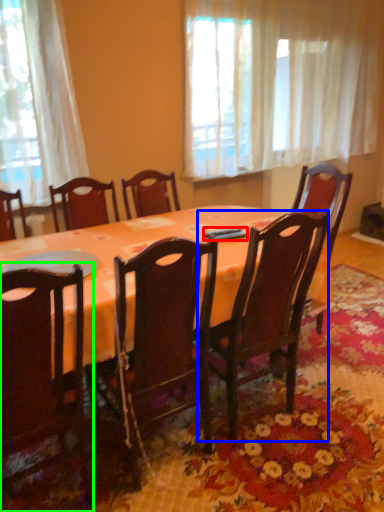
Question: Which object is the closest to the remote control (highlighted by a red box)? Choose among these: chair (highlighted by a blue box) or chair (highlighted by a green box).

Choices:
 (A) chair
 (B) chair

Answer: (A)